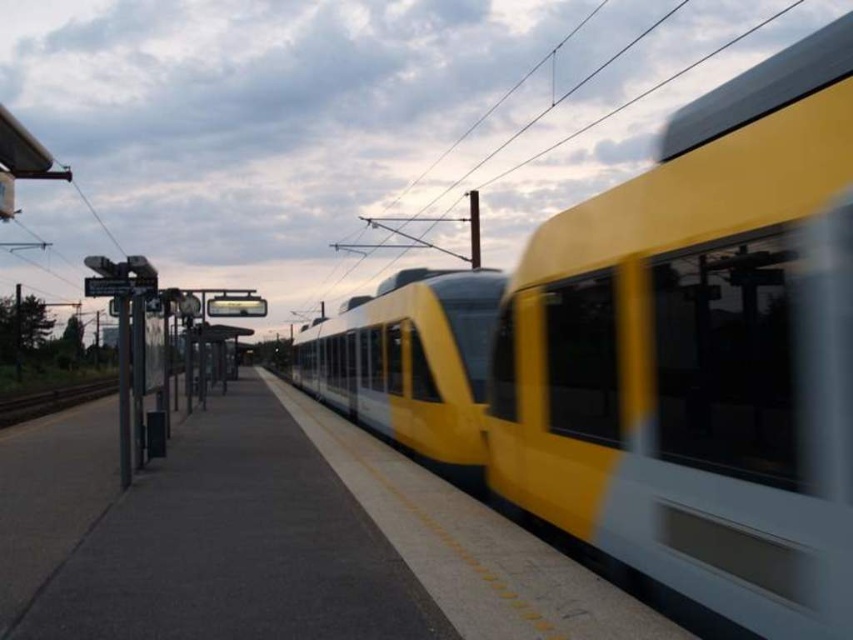
Question: Which point appears farthest from the camera in this image?

Choices:
 (A) (88, 550)
 (B) (779, 314)

Answer: (A)

Question: Which of the following is the closest to the observer?

Choices:
 (A) (270, 445)
 (B) (486, 342)
 (C) (24, 397)

Answer: (B)

Question: Which object is the farthest from the smooth concrete platform at center?

Choices:
 (A) brown wooden train track at lower left
 (B) yellow matte train at center

Answer: (A)

Question: Does yellow matte train at center have a lesser width compared to smooth concrete platform at center?

Choices:
 (A) no
 (B) yes

Answer: (B)

Question: Can you confirm if yellow matte train at center is positioned above brown wooden train track at lower left?

Choices:
 (A) yes
 (B) no

Answer: (A)

Question: In this image, where is smooth concrete platform at center located relative to brown wooden train track at lower left?

Choices:
 (A) above
 (B) below

Answer: (A)